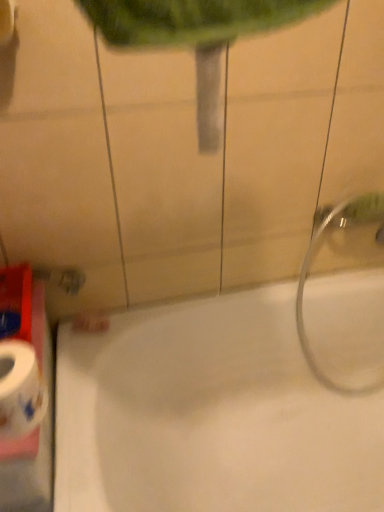
The image size is (384, 512). Find the location of `white glossy bathtub at lower right`. white glossy bathtub at lower right is located at coordinates (236, 392).

At what (x,y) coordinates should I click in order to perform the action: click on silver metallic showerhead at right. Please return your answer as a coordinate pair (x, y). Image resolution: width=384 pixels, height=512 pixels. Looking at the image, I should click on (345, 296).

At what (x,y) coordinates should I click in order to perform the action: click on white glossy toilet paper at lower left. Please return your answer as a coordinate pair (x, y). The width and height of the screenshot is (384, 512). Looking at the image, I should click on (20, 390).

Consider the image. Between white glossy toilet paper at lower left and white glossy bathtub at lower right, which one has smaller width?

Thinner between the two is white glossy toilet paper at lower left.

Considering the positions of points (15, 411) and (83, 441), is point (15, 411) closer to camera compared to point (83, 441)?

Yes, it is in front of point (83, 441).

Between white glossy toilet paper at lower left and white glossy bathtub at lower right, which one has less height?

white glossy toilet paper at lower left is shorter.

Which object is further away from the camera, silver metallic showerhead at right or white glossy bathtub at lower right?

silver metallic showerhead at right is behind.

Is silver metallic showerhead at right aimed at white glossy bathtub at lower right?

Yes, silver metallic showerhead at right is aimed at white glossy bathtub at lower right.

Looking at this image, from a real-world perspective, is silver metallic showerhead at right located higher than white glossy bathtub at lower right?

Indeed, from a real-world perspective, silver metallic showerhead at right stands above white glossy bathtub at lower right.

From the image's perspective, which one is positioned lower, silver metallic showerhead at right or white glossy bathtub at lower right?

From the image's view, white glossy bathtub at lower right is below.

Which of these two, white glossy bathtub at lower right or silver metallic showerhead at right, stands taller?

silver metallic showerhead at right.

Identify the location of bathtub in front of the silver metallic showerhead at right. (236, 392).

Considering the sizes of white glossy bathtub at lower right and silver metallic showerhead at right in the image, is white glossy bathtub at lower right wider or thinner than silver metallic showerhead at right?

Answer: In the image, white glossy bathtub at lower right appears to be wider than silver metallic showerhead at right.

How many degrees apart are the facing directions of white glossy bathtub at lower right and silver metallic showerhead at right?

0.00186 degrees separate the facing orientations of white glossy bathtub at lower right and silver metallic showerhead at right.

In the image, is white glossy toilet paper at lower left on the left side or the right side of silver metallic showerhead at right?

In the image, white glossy toilet paper at lower left appears on the left side of silver metallic showerhead at right.

Which object is thinner, white glossy toilet paper at lower left or silver metallic showerhead at right?

white glossy toilet paper at lower left.

Is point (23, 355) less distant than point (346, 295)?

Yes.

In the scene shown: From a real-world perspective, is white glossy toilet paper at lower left positioned above or below silver metallic showerhead at right?

white glossy toilet paper at lower left is situated higher than silver metallic showerhead at right in the real world.

Consider the image. From the image's perspective, is silver metallic showerhead at right above or below white glossy toilet paper at lower left?

silver metallic showerhead at right is above white glossy toilet paper at lower left.

How many degrees apart are the facing directions of silver metallic showerhead at right and white glossy toilet paper at lower left?

There is a 0.00201-degree angle between the facing directions of silver metallic showerhead at right and white glossy toilet paper at lower left.

Looking at their sizes, would you say silver metallic showerhead at right is wider or thinner than white glossy toilet paper at lower left?

silver metallic showerhead at right is wider than white glossy toilet paper at lower left.

Does silver metallic showerhead at right touch white glossy toilet paper at lower left?

No, silver metallic showerhead at right is not making contact with white glossy toilet paper at lower left.

Which is in front, white glossy bathtub at lower right or white glossy toilet paper at lower left?

white glossy toilet paper at lower left is in front.

Who is bigger, white glossy bathtub at lower right or white glossy toilet paper at lower left?

With larger size is white glossy bathtub at lower right.

At what (x,y) coordinates should I click in order to perform the action: click on toilet paper that appears in front of the white glossy bathtub at lower right. Please return your answer as a coordinate pair (x, y). Looking at the image, I should click on (20, 390).

From a real-world perspective, is white glossy bathtub at lower right above or below white glossy toilet paper at lower left?

In terms of real-world spatial position, white glossy bathtub at lower right is below white glossy toilet paper at lower left.

Locate an element on the screen. The image size is (384, 512). bathtub below the white glossy toilet paper at lower left (from the image's perspective) is located at coordinates (236, 392).

You are a GUI agent. You are given a task and a screenshot of the screen. Output one action in this format:
    pyautogui.click(x=<x>, y=<y>)
    Task: Click on the bathtub located in front of the silver metallic showerhead at right
    The width and height of the screenshot is (384, 512).
    Given the screenshot: What is the action you would take?
    pyautogui.click(x=236, y=392)

Estimate the real-world distances between objects in this image. Which object is closer to white glossy bathtub at lower right, white glossy toilet paper at lower left or silver metallic showerhead at right?

silver metallic showerhead at right.

Based on their spatial positions, is white glossy toilet paper at lower left or white glossy bathtub at lower right further from silver metallic showerhead at right?

white glossy toilet paper at lower left lies further to silver metallic showerhead at right than the other object.

Estimate the real-world distances between objects in this image. Which object is closer to white glossy toilet paper at lower left, white glossy bathtub at lower right or silver metallic showerhead at right?

white glossy bathtub at lower right.

When comparing their distances from silver metallic showerhead at right, does white glossy bathtub at lower right or white glossy toilet paper at lower left seem closer?

Among the two, white glossy bathtub at lower right is located nearer to silver metallic showerhead at right.

Estimate the real-world distances between objects in this image. Which object is closer to white glossy bathtub at lower right, silver metallic showerhead at right or white glossy toilet paper at lower left?

Among the two, silver metallic showerhead at right is located nearer to white glossy bathtub at lower right.

Considering their positions, is silver metallic showerhead at right positioned closer to white glossy toilet paper at lower left than white glossy bathtub at lower right?

Among the two, white glossy bathtub at lower right is located nearer to white glossy toilet paper at lower left.

This screenshot has width=384, height=512. I want to click on bathtub between white glossy toilet paper at lower left and silver metallic showerhead at right in the horizontal direction, so click(x=236, y=392).